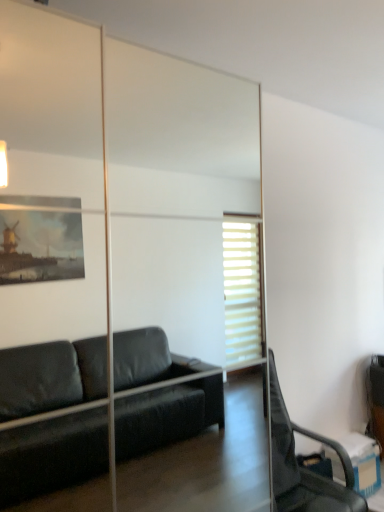
The height and width of the screenshot is (512, 384). What are the coordinates of `black leather chair at center` in the screenshot? It's located at (303, 467).

Measure the distance between point [279,423] and camera.

3.29 meters.

Describe the element at coordinates (303, 467) in the screenshot. I see `black leather chair at center` at that location.

Locate an element on the screen. black leather chair at center is located at coordinates (303, 467).